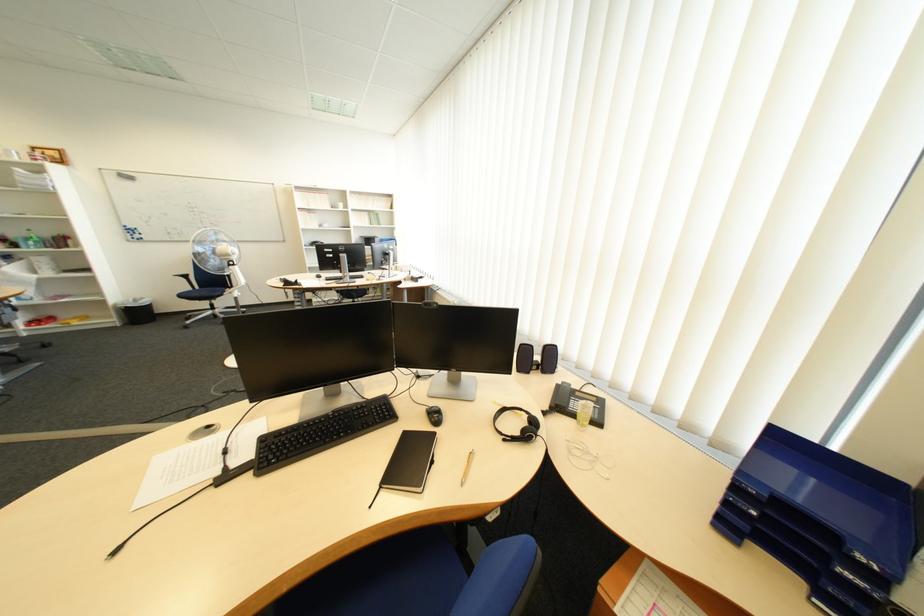
Find where to open the black notebook. Please return your answer as a coordinate pair (x, y).

(409, 462)